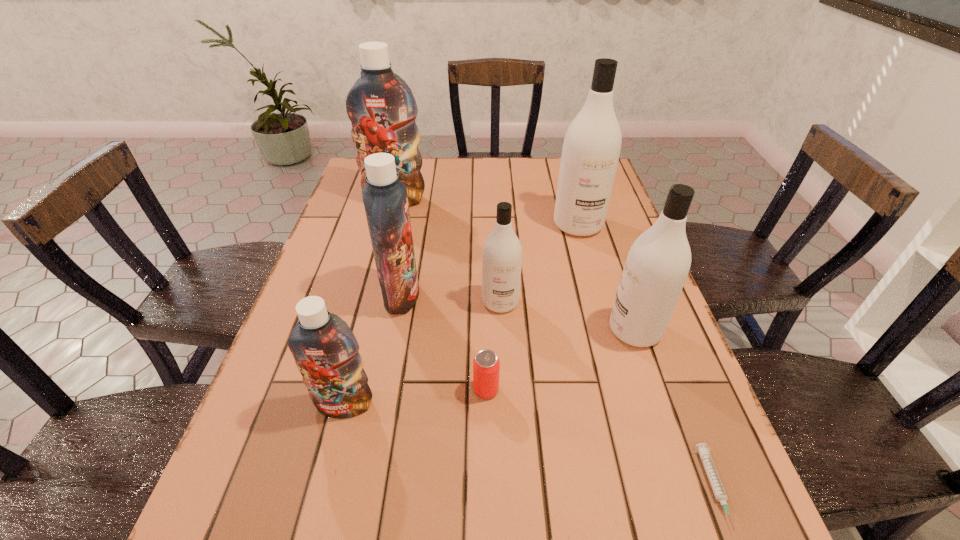
Find the location of `empty space between the third shampoo from right to left and the red beer can`. empty space between the third shampoo from right to left and the red beer can is located at coordinates (493, 346).

I want to click on object that is the closest to the syringe, so click(657, 265).

Locate which object ranks second in proximity to the beer can. Please provide its 2D coordinates. Your answer should be formatted as a tuple, i.e. [(x, y)], where the tuple contains the x and y coordinates of a point satisfying the conditions above.

[(326, 352)]

Where is `shampoo that is the nearest to the farthest white shampoo`? shampoo that is the nearest to the farthest white shampoo is located at coordinates (502, 252).

At what (x,y) coordinates should I click in order to perform the action: click on shampoo object that ranks as the fourth closest to the second nearest blue shampoo. Please return your answer as a coordinate pair (x, y). The image size is (960, 540). Looking at the image, I should click on (591, 149).

You are a GUI agent. You are given a task and a screenshot of the screen. Output one action in this format:
    pyautogui.click(x=<x>, y=<y>)
    Task: Click on the white shampoo that is the second closest to the biggest blue shampoo
    This screenshot has width=960, height=540.
    Given the screenshot: What is the action you would take?
    pyautogui.click(x=502, y=252)

Locate an element on the screen. The image size is (960, 540). white shampoo that is the third closest to the second smallest blue shampoo is located at coordinates (657, 265).

Image resolution: width=960 pixels, height=540 pixels. I want to click on the second closest blue shampoo to the biggest blue shampoo, so click(x=326, y=352).

The height and width of the screenshot is (540, 960). I want to click on blue shampoo that is the nearest to the smallest blue shampoo, so click(x=385, y=199).

Locate an element on the screen. vacant space that satisfies the following two spatial constraints: 1. on the front label of the second nearest blue shampoo; 2. on the left side of the red beer can is located at coordinates (383, 390).